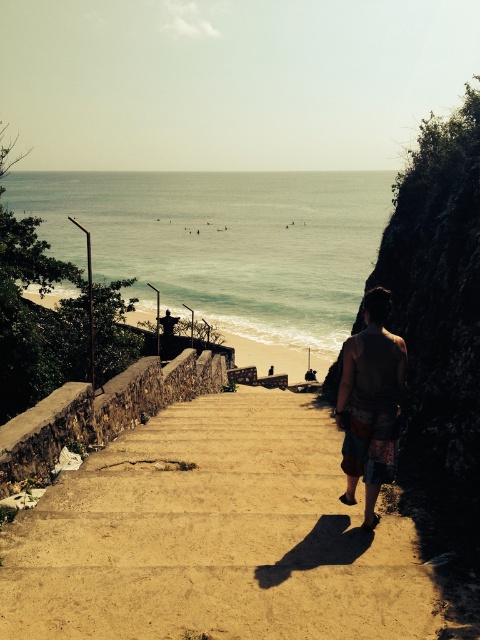
Does brown fabric bag at center appear on the right side of smooth concrete stairs at center?

Yes, brown fabric bag at center is to the right of smooth concrete stairs at center.

Who is higher up, brown fabric bag at center or smooth concrete stairs at center?

smooth concrete stairs at center is higher up.

This screenshot has height=640, width=480. Find the location of `brown fabric bag at center`. brown fabric bag at center is located at coordinates (371, 403).

You are a GUI agent. You are given a task and a screenshot of the screen. Output one action in this format:
    pyautogui.click(x=<x>, y=<y>)
    Task: Click on the brown fabric bag at center
    The width and height of the screenshot is (480, 640).
    Given the screenshot: What is the action you would take?
    pyautogui.click(x=371, y=403)

Does point (320, 209) come closer to viewer compared to point (303, 348)?

No, (320, 209) is further to viewer.

This screenshot has width=480, height=640. What do you see at coordinates (224, 243) in the screenshot?
I see `greenish-blue water at center` at bounding box center [224, 243].

Identify the location of greenish-blue water at center. This screenshot has height=640, width=480. (224, 243).

Between brown concrete stairs at center and greenish-blue water at center, which one is positioned lower?

brown concrete stairs at center

Between brown concrete stairs at center and greenish-blue water at center, which one is positioned higher?

greenish-blue water at center is higher up.

Between point (314, 483) and point (294, 307), which one is positioned behind?

The point (294, 307) is more distant.

Locate an element on the screen. brown concrete stairs at center is located at coordinates (214, 536).